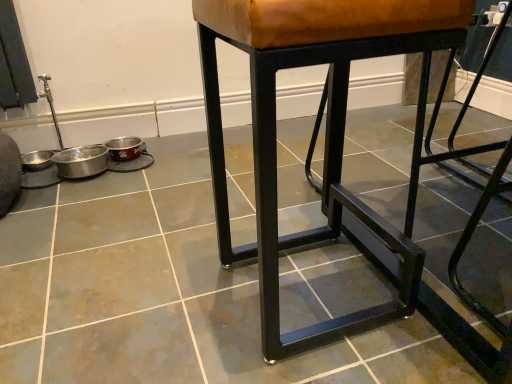
This screenshot has height=384, width=512. What do you see at coordinates (164, 292) in the screenshot?
I see `black metal stool at center` at bounding box center [164, 292].

Where is `black metal stool at center`? This screenshot has height=384, width=512. black metal stool at center is located at coordinates pyautogui.click(x=164, y=292).

Locate an element on the screen. brown leather stool at center is located at coordinates (326, 130).

Measure the distance between point (333,61) and camera.

A distance of 25.79 inches exists between point (333,61) and camera.

What do you see at coordinates (326, 130) in the screenshot? The height and width of the screenshot is (384, 512). I see `brown leather stool at center` at bounding box center [326, 130].

The image size is (512, 384). Identify the location of black metal stool at center. (164, 292).

Consider the image. Is brown leather stool at center to the right of black metal stool at center from the viewer's perspective?

Correct, you'll find brown leather stool at center to the right of black metal stool at center.

Relative to black metal stool at center, is brown leather stool at center in front or behind?

brown leather stool at center is behind black metal stool at center.

Does point (316, 337) come farther from viewer compared to point (241, 142)?

No, it is not.

From the image's perspective, is brown leather stool at center located beneath black metal stool at center?

No, from the image's perspective, brown leather stool at center is not below black metal stool at center.

From a real-world perspective, is brown leather stool at center positioned over black metal stool at center based on gravity?

Indeed, from a real-world perspective, brown leather stool at center stands above black metal stool at center.

Does brown leather stool at center have a lesser width compared to black metal stool at center?

Indeed, brown leather stool at center has a lesser width compared to black metal stool at center.

Considering the sizes of brown leather stool at center and black metal stool at center in the image, is brown leather stool at center taller or shorter than black metal stool at center?

brown leather stool at center is taller than black metal stool at center.

Between brown leather stool at center and black metal stool at center, which one has smaller size?

brown leather stool at center is smaller.

Is brown leather stool at center situated inside black metal stool at center or outside?

brown leather stool at center is spatially situated outside black metal stool at center.

Is there a large distance between brown leather stool at center and black metal stool at center?

Actually, brown leather stool at center and black metal stool at center are a little close together.

Is brown leather stool at center looking in the opposite direction of black metal stool at center?

brown leather stool at center is not turned away from black metal stool at center.

How different are the orientations of brown leather stool at center and black metal stool at center in degrees?

brown leather stool at center and black metal stool at center are facing 89.3 degrees away from each other.

This screenshot has width=512, height=384. I want to click on concrete located below the brown leather stool at center (from the image's perspective), so click(164, 292).

Can you confirm if black metal stool at center is positioned to the right of brown leather stool at center?

No, black metal stool at center is not to the right of brown leather stool at center.

Considering the positions of objects black metal stool at center and brown leather stool at center in the image provided, who is behind, black metal stool at center or brown leather stool at center?

brown leather stool at center is behind.

Is point (234, 345) positioned before point (227, 249)?

Yes, it is.

From the image's perspective, does black metal stool at center appear higher than brown leather stool at center?

No.

From a real-world perspective, is black metal stool at center located higher than brown leather stool at center?

No.

Considering the relative sizes of black metal stool at center and brown leather stool at center in the image provided, is black metal stool at center wider than brown leather stool at center?

Correct, the width of black metal stool at center exceeds that of brown leather stool at center.

Which of these two, black metal stool at center or brown leather stool at center, stands taller?

With more height is brown leather stool at center.

Considering the sizes of objects black metal stool at center and brown leather stool at center in the image provided, who is bigger, black metal stool at center or brown leather stool at center?

black metal stool at center is bigger.

Does black metal stool at center contain brown leather stool at center?

Actually, brown leather stool at center is outside black metal stool at center.

Is black metal stool at center in contact with brown leather stool at center?

black metal stool at center and brown leather stool at center are not in contact.

Is black metal stool at center turned away from brown leather stool at center?

No, black metal stool at center's orientation is not away from brown leather stool at center.

Based on the photo, how many degrees apart are the facing directions of black metal stool at center and brown leather stool at center?

There is a 89.3-degree angle between the facing directions of black metal stool at center and brown leather stool at center.

Measure the distance between black metal stool at center and brown leather stool at center.

They are 11.37 inches apart.

The width and height of the screenshot is (512, 384). I want to click on concrete below the brown leather stool at center (from the image's perspective), so click(x=164, y=292).

Locate an element on the screen. This screenshot has width=512, height=384. stool positioned vertically above the black metal stool at center (from a real-world perspective) is located at coordinates (326, 130).

You are a GUI agent. You are given a task and a screenshot of the screen. Output one action in this format:
    pyautogui.click(x=<x>, y=<y>)
    Task: Click on the stool above the black metal stool at center (from the image's perspective)
    This screenshot has height=384, width=512.
    Given the screenshot: What is the action you would take?
    pyautogui.click(x=326, y=130)